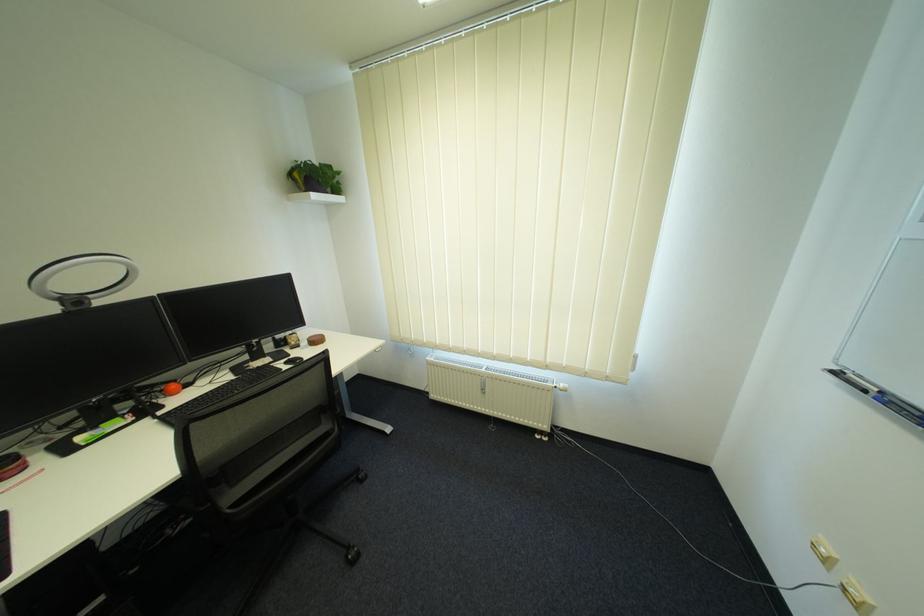
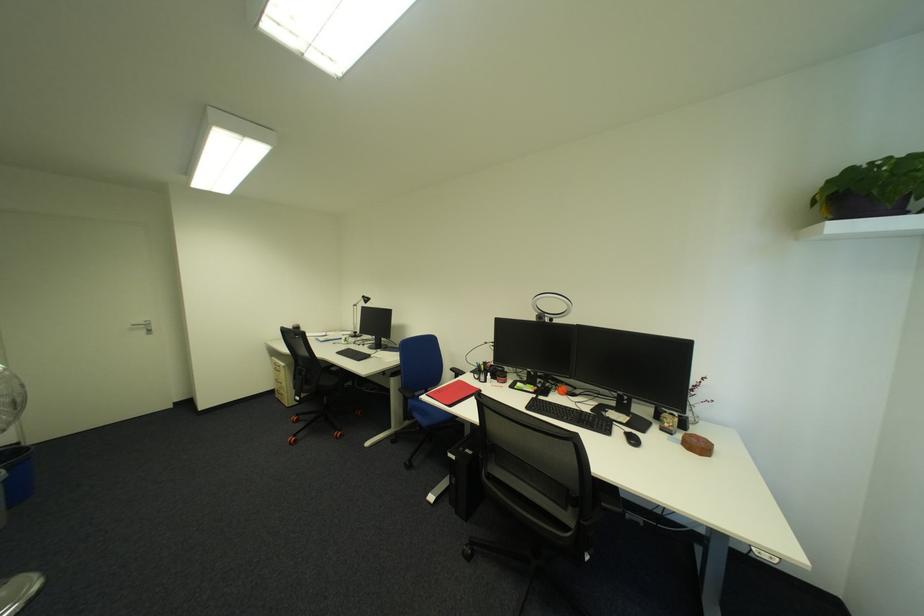
Locate, in the second image, the point that corresponds to [56,310] in the first image.

(542, 318)